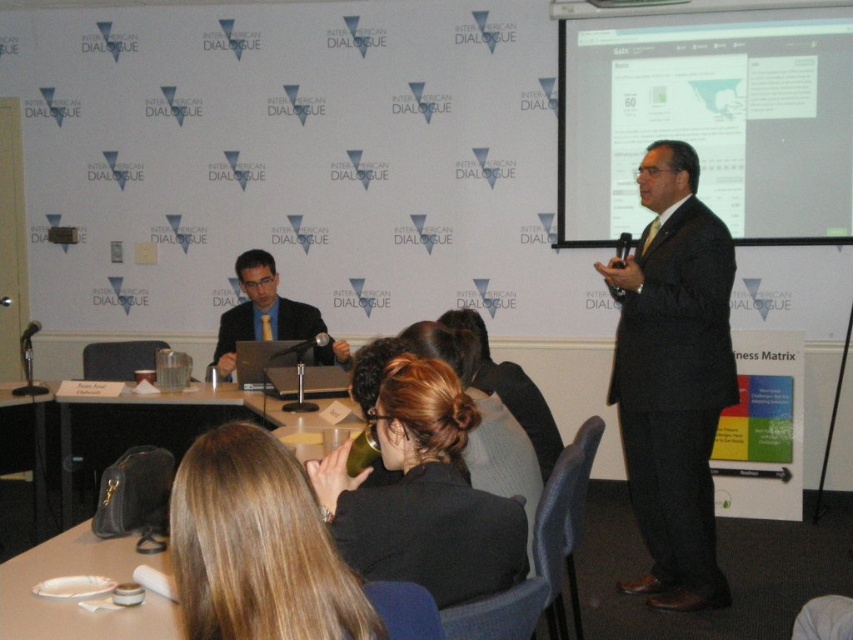
Does dark gray suit at center have a larger size compared to matte black jacket at center?

Indeed, dark gray suit at center has a larger size compared to matte black jacket at center.

Between dark gray suit at center and matte black jacket at center, which one has more height?

dark gray suit at center

This screenshot has width=853, height=640. In order to click on dark gray suit at center in this screenshot , I will do `click(672, 378)`.

Is point (701, 92) less distant than point (312, 333)?

That is False.

Between matte white projector screen at upper right and matte black suit at center, which one appears on the right side from the viewer's perspective?

matte white projector screen at upper right

Which is in front, point (717, 209) or point (276, 328)?

Positioned in front is point (276, 328).

What are the coordinates of `matte white projector screen at upper right` in the screenshot? It's located at (711, 118).

Describe the element at coordinates (672, 378) in the screenshot. I see `dark gray suit at center` at that location.

Does dark gray suit at center come in front of black leather table at lower left?

Yes, it is in front of black leather table at lower left.

The image size is (853, 640). What are the coordinates of `dark gray suit at center` in the screenshot? It's located at (672, 378).

This screenshot has height=640, width=853. Find the location of `dark gray suit at center`. dark gray suit at center is located at coordinates (672, 378).